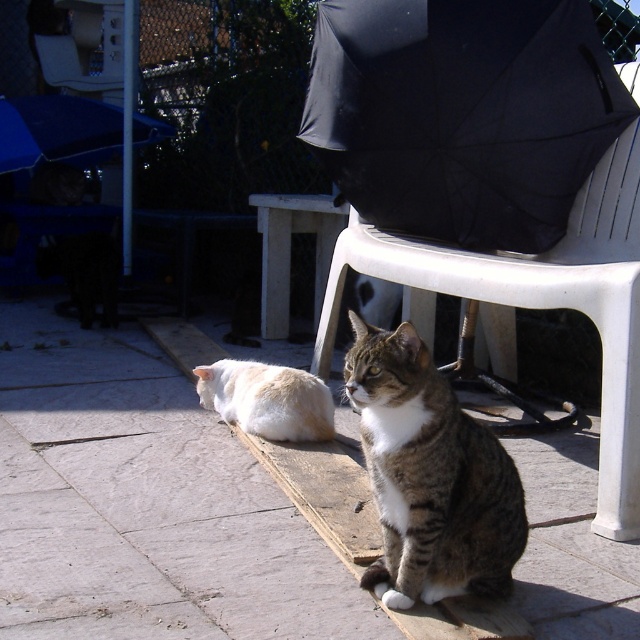
Question: Estimate the real-world distances between objects in this image. Which object is farther from the blue fabric umbrella at upper left?

Choices:
 (A) white plastic stool at center
 (B) white fluffy cat at lower left
 (C) black fabric umbrella at upper center

Answer: (C)

Question: Which point is closer to the camera?

Choices:
 (A) white plastic chair at center
 (B) white plastic stool at center

Answer: (A)

Question: Which of the following is the farthest from the observer?

Choices:
 (A) (301, 412)
 (B) (454, 243)
 (C) (289, 243)

Answer: (C)

Question: Is white plastic chair at center closer to the viewer compared to white fluffy cat at lower left?

Choices:
 (A) no
 (B) yes

Answer: (B)

Question: Is black fabric umbrella at upper center wider than white plastic chair at center?

Choices:
 (A) no
 (B) yes

Answer: (A)

Question: Can you confirm if tabby fur cat at center is positioned above blue fabric umbrella at upper left?

Choices:
 (A) no
 (B) yes

Answer: (A)